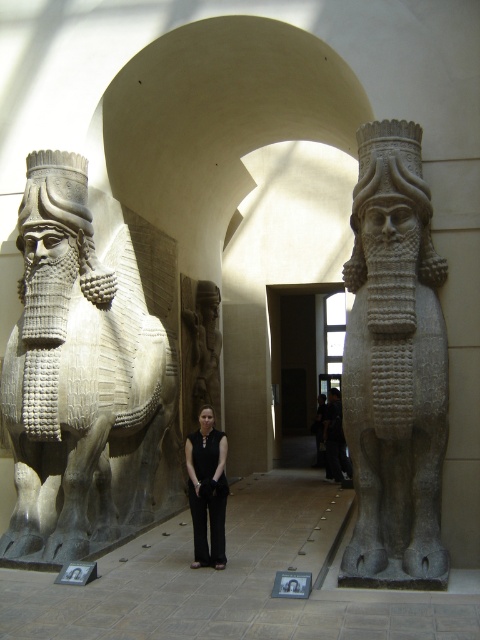
In the scene shown: You are a tour guide explaining the museum layout to visitors. You mention both the gray stone lion at right and the gray stone relief at center. Which one is taller?

The gray stone lion at right is taller than the gray stone relief at center.

You are a museum visitor carrying a 1.2 meter wide painting. You need to walk through the central pathway and pass between the gray stone lion at left and the black fabric pants at center. Can your painting fit through the space between them?

The gray stone lion at left is wider than the black fabric pants at center. Since the painting is 1.2 meters wide, you need to ensure the space between them is at least that width. However, without knowing the exact width of either object, it is impossible to determine if the painting will fit. Please check the actual dimensions or consult a museum staff member for assistance.